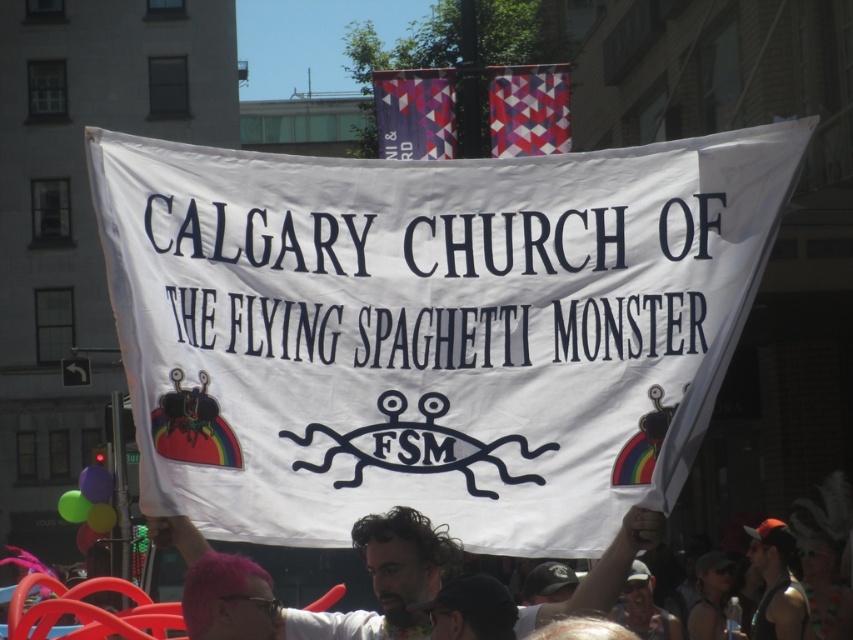
Question: Which of the following is the closest to the observer?

Choices:
 (A) black fabric cap at lower right
 (B) translucent plastic balloon at lower left
 (C) rubber balloons at lower left

Answer: (A)

Question: Is curly hair at center bigger than black fabric cap at lower right?

Choices:
 (A) yes
 (B) no

Answer: (A)

Question: Does white paper banner at center lie behind curly hair at center?

Choices:
 (A) yes
 (B) no

Answer: (B)

Question: Does black fabric cap at lower right appear under translucent plastic balloon at lower left?

Choices:
 (A) yes
 (B) no

Answer: (A)

Question: Considering the real-world distances, which object is closest to the black fabric cap at lower right?

Choices:
 (A) rubber balloons at lower left
 (B) translucent plastic balloon at lower left
 (C) white paper banner at center
 (D) curly hair at center

Answer: (A)

Question: Which object is closer to the camera taking this photo?

Choices:
 (A) curly hair at center
 (B) rubber balloons at lower left

Answer: (A)